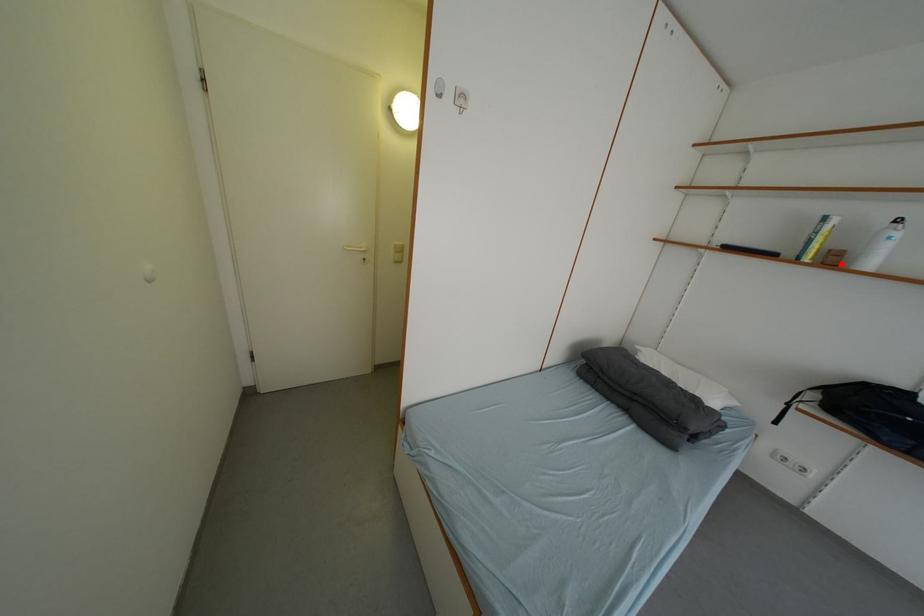
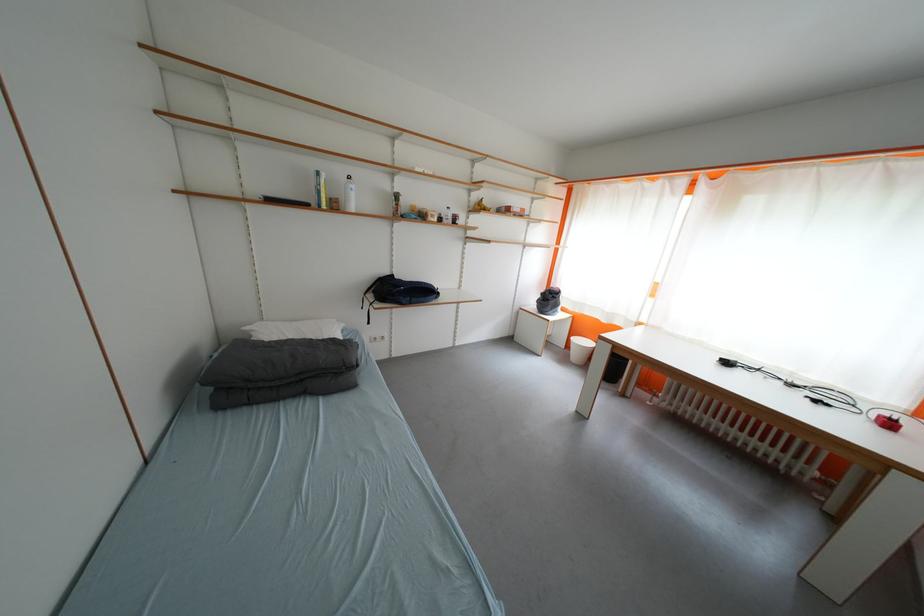
The point at the highlighted location is marked in the first image. Where is the corresponding point in the second image?

(344, 209)